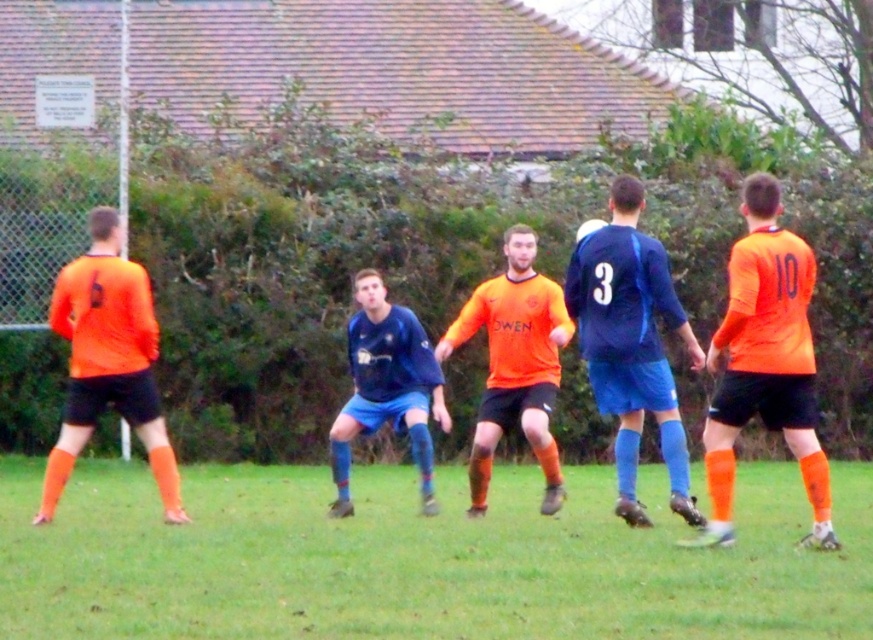
Is matte orange jersey at center bigger than orange matte jersey at center?

Yes, matte orange jersey at center is bigger than orange matte jersey at center.

How far apart are matte orange jersey at center and orange matte jersey at center?

matte orange jersey at center is 1.61 meters from orange matte jersey at center.

This screenshot has height=640, width=873. Identify the location of matte orange jersey at center. (650, 358).

Can you confirm if orange matte jersey at right is taller than blue jersey at center?

Correct, orange matte jersey at right is much taller as blue jersey at center.

Can you confirm if orange matte jersey at right is positioned to the left of blue jersey at center?

In fact, orange matte jersey at right is to the right of blue jersey at center.

Consider the image. Who is more distant from viewer, (772, 403) or (348, 426)?

Point (348, 426)

Find the location of a particular element. orange matte jersey at right is located at coordinates (765, 362).

Can you confirm if orange matte jersey at right is thinner than blue matte jersey at center?

No, orange matte jersey at right is not thinner than blue matte jersey at center.

Is orange matte jersey at right bigger than blue matte jersey at center?

Yes, orange matte jersey at right is bigger than blue matte jersey at center.

In order to click on orange matte jersey at right in this screenshot , I will do `click(765, 362)`.

The image size is (873, 640). Find the location of `orange matte jersey at right`. orange matte jersey at right is located at coordinates (765, 362).